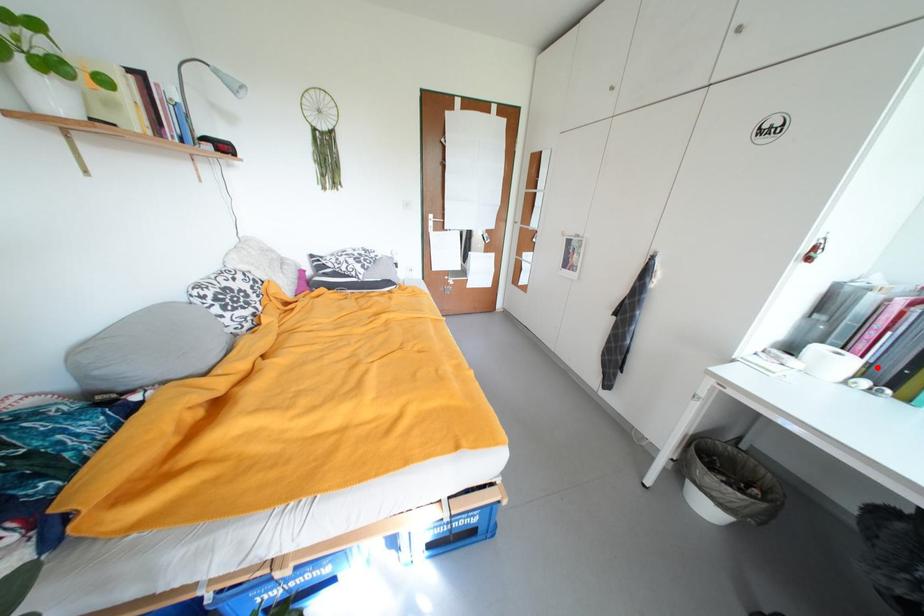
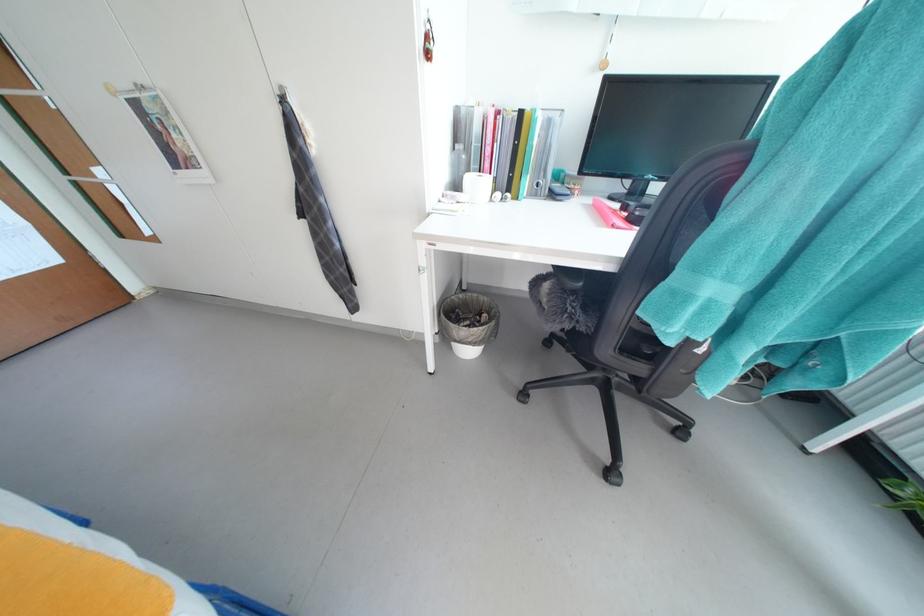
Where in the second image is the point corresponding to the highlighted location from the first image?

(503, 182)